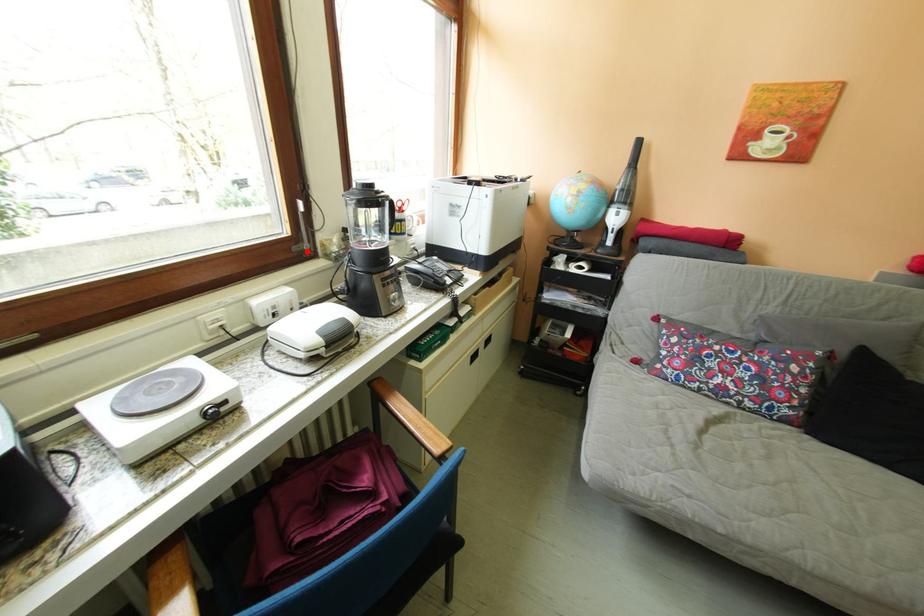
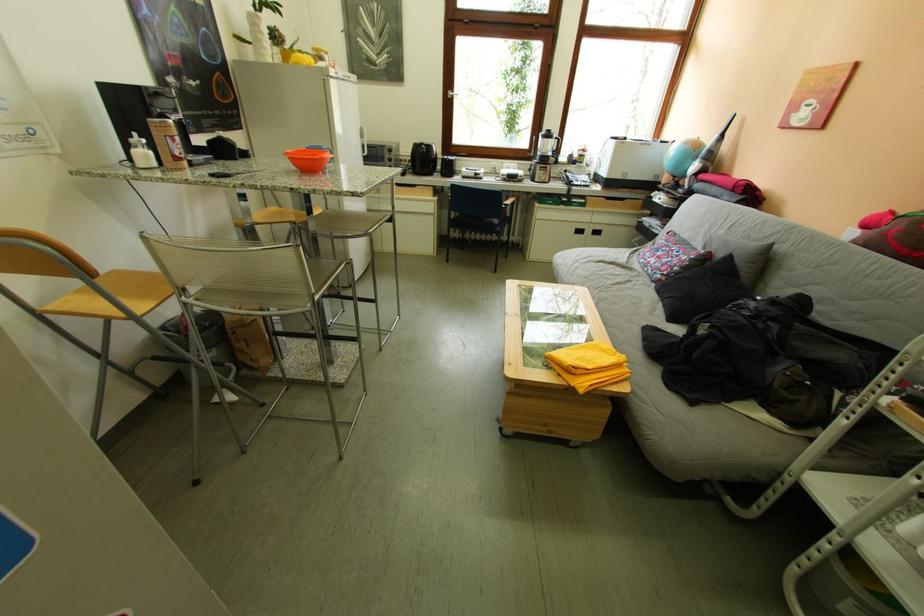
Question: I am providing you with two images of the same scene from different viewpoints. Given a red point in image1, look at the same physical point in image2. Is it:

Choices:
 (A) Closer to the viewpoint
 (B) Farther from the viewpoint

Answer: (A)